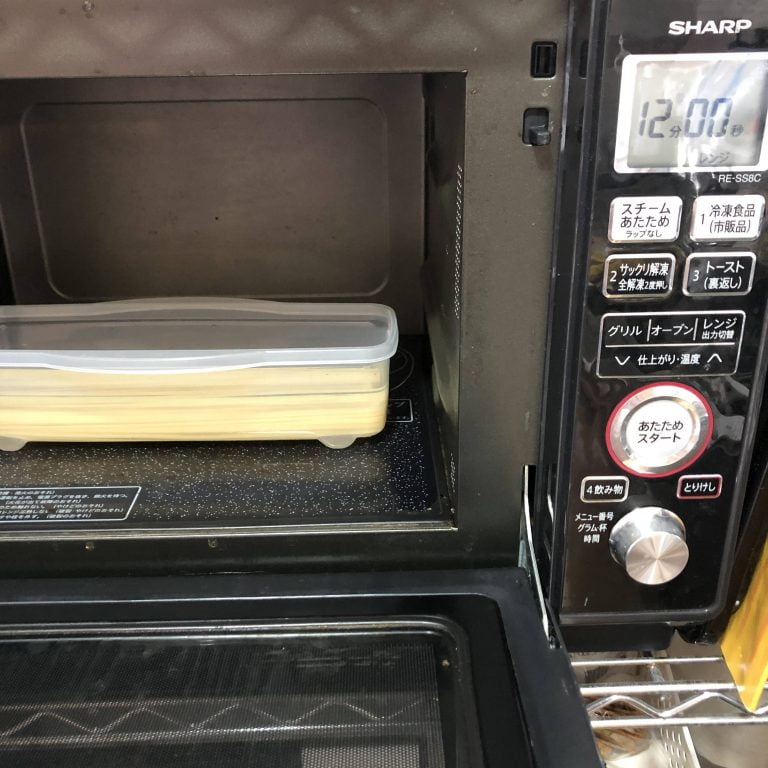
Locate an element on the screen. Image resolution: width=768 pixels, height=768 pixels. this is where the oven door snaps closed is located at coordinates (538, 130).